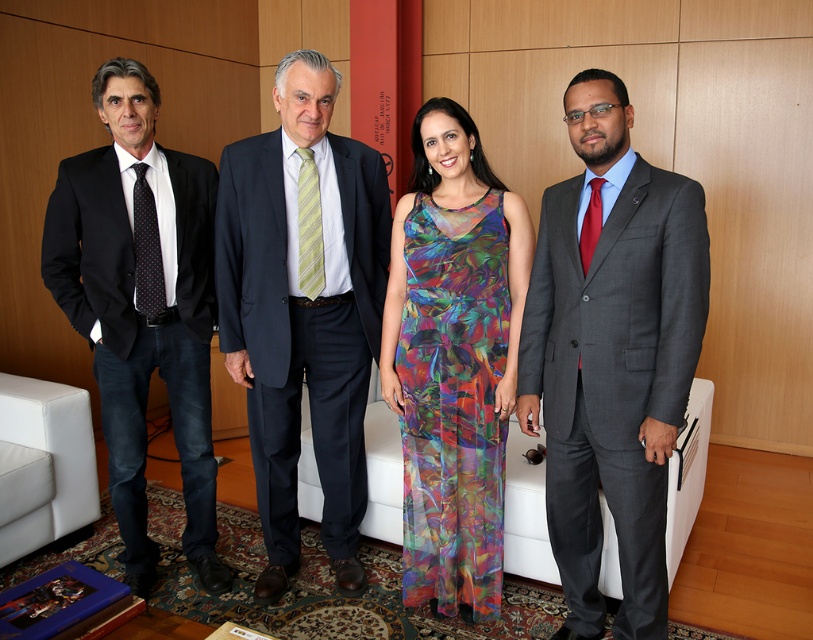
Question: Is dark blue suit at center to the right of multicolored chiffon dress at center from the viewer's perspective?

Choices:
 (A) no
 (B) yes

Answer: (A)

Question: Which of these objects is positioned farthest from the matte black suit at left?

Choices:
 (A) multicolored chiffon dress at center
 (B) dark blue suit at center

Answer: (A)

Question: Considering the real-world distances, which object is farthest from the matte black suit at left?

Choices:
 (A) gray suit at right
 (B) dark blue suit at center
 (C) multicolored chiffon dress at center

Answer: (A)

Question: Is gray suit at right bigger than dark blue suit at center?

Choices:
 (A) no
 (B) yes

Answer: (A)

Question: Can you confirm if dark blue suit at center is bigger than matte black suit at left?

Choices:
 (A) yes
 (B) no

Answer: (A)

Question: Estimate the real-world distances between objects in this image. Which object is closer to the multicolored chiffon dress at center?

Choices:
 (A) dark blue suit at center
 (B) gray suit at right
 (C) matte black suit at left

Answer: (B)